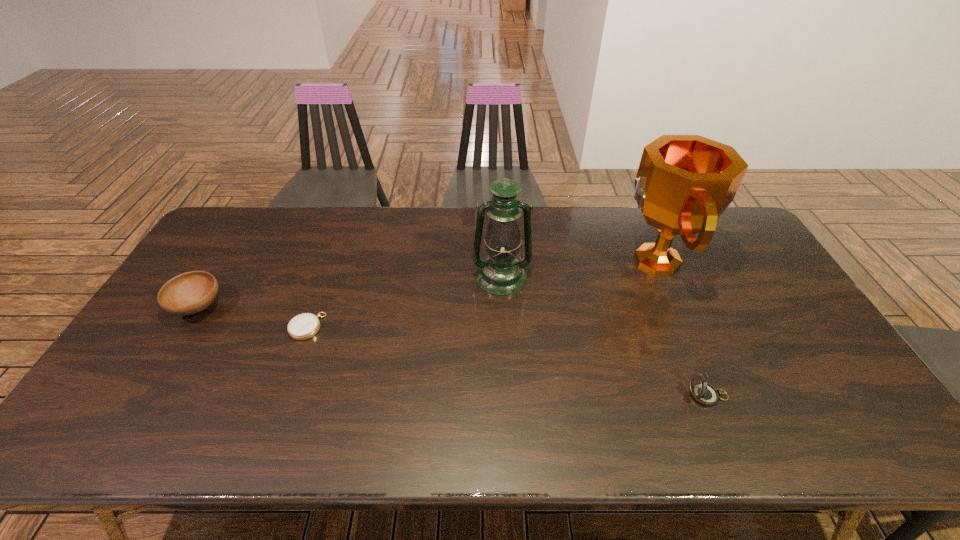
The height and width of the screenshot is (540, 960). What are the coordinates of `vacant space located 0.060m on the front of the third object from left to right` in the screenshot? It's located at (503, 310).

This screenshot has width=960, height=540. I want to click on free region located on the face of the right compass, so click(x=590, y=396).

Locate an element on the screen. free space located on the face of the right compass is located at coordinates (570, 396).

Where is `free space located 0.100m on the face of the right compass`? The height and width of the screenshot is (540, 960). free space located 0.100m on the face of the right compass is located at coordinates (648, 396).

What are the coordinates of `vacant space located on the back of the bowl` in the screenshot? It's located at (228, 259).

Where is `vacant space located on the front of the farther compass`? Image resolution: width=960 pixels, height=540 pixels. vacant space located on the front of the farther compass is located at coordinates (294, 362).

Where is `object situated at the far edge`? object situated at the far edge is located at coordinates (684, 183).

The height and width of the screenshot is (540, 960). In order to click on object that is at the left edge in this screenshot , I will do `click(189, 293)`.

This screenshot has width=960, height=540. I want to click on blank area at the far edge, so click(x=442, y=241).

This screenshot has height=540, width=960. What are the coordinates of `free space at the near edge of the desktop` in the screenshot? It's located at click(x=558, y=430).